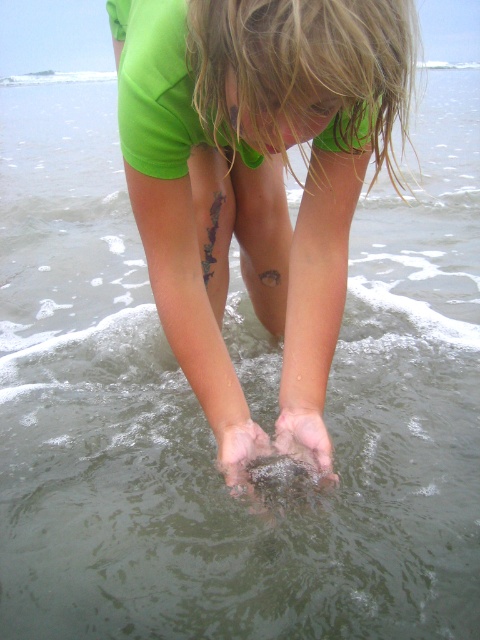
Question: Estimate the real-world distances between objects in this image. Which object is closer to the dry sand at feet lower?

Choices:
 (A) smooth skin hand at lower center
 (B) green matte shorts at center

Answer: (A)

Question: Can you confirm if green matte shorts at center is positioned above smooth skin hand at lower center?

Choices:
 (A) no
 (B) yes

Answer: (B)

Question: Which object appears closest to the camera in this image?

Choices:
 (A) dry sand at feet lower
 (B) smooth skin hand at lower center
 (C) green matte shorts at center

Answer: (C)

Question: Is smooth skin hand at lower center smaller than dry sand at feet lower?

Choices:
 (A) yes
 (B) no

Answer: (B)

Question: Which point appears farthest from the camera in this image?

Choices:
 (A) (265, 104)
 (B) (327, 451)
 (C) (252, 458)

Answer: (C)

Question: In this image, where is green matte shorts at center located relative to smooth skin hand at lower center?

Choices:
 (A) left
 (B) right

Answer: (A)